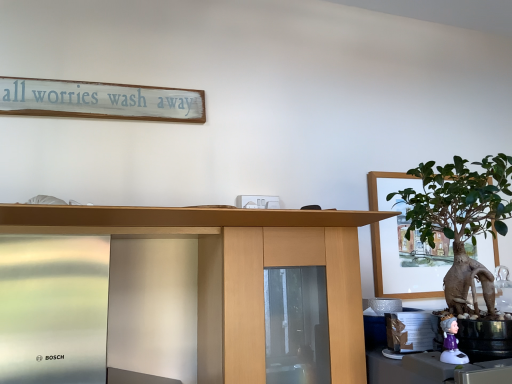
Question: Can you confirm if white painted wood signboard at upper center is taller than white plastic figurine at lower right?

Choices:
 (A) yes
 (B) no

Answer: (A)

Question: Is white painted wood signboard at upper center not close to white plastic figurine at lower right?

Choices:
 (A) yes
 (B) no

Answer: (A)

Question: Is white painted wood signboard at upper center at the left side of white plastic figurine at lower right?

Choices:
 (A) no
 (B) yes

Answer: (B)

Question: Is white painted wood signboard at upper center closer to the viewer compared to white plastic figurine at lower right?

Choices:
 (A) yes
 (B) no

Answer: (B)

Question: Is white painted wood signboard at upper center positioned behind white plastic figurine at lower right?

Choices:
 (A) no
 (B) yes

Answer: (B)

Question: Does point (269, 261) appear closer or farther from the camera than point (452, 322)?

Choices:
 (A) farther
 (B) closer

Answer: (A)

Question: Is wooden desk at center to the left or to the right of white plastic figurine at lower right in the image?

Choices:
 (A) right
 (B) left

Answer: (B)

Question: Based on their sizes in the image, would you say wooden desk at center is bigger or smaller than white plastic figurine at lower right?

Choices:
 (A) small
 (B) big

Answer: (B)

Question: Looking at their shapes, would you say wooden desk at center is wider or thinner than white plastic figurine at lower right?

Choices:
 (A) thin
 (B) wide

Answer: (B)

Question: Visually, is green matte houseplant at right positioned to the left or to the right of wooden desk at center?

Choices:
 (A) right
 (B) left

Answer: (A)

Question: Is green matte houseplant at right inside the boundaries of wooden desk at center, or outside?

Choices:
 (A) outside
 (B) inside

Answer: (A)

Question: Is green matte houseplant at right in front of or behind wooden desk at center in the image?

Choices:
 (A) behind
 (B) front

Answer: (A)

Question: Is point (500, 340) positioned closer to the camera than point (350, 337)?

Choices:
 (A) farther
 (B) closer

Answer: (B)

Question: From the image's perspective, is white painted wood signboard at upper center above or below wooden desk at center?

Choices:
 (A) below
 (B) above

Answer: (B)

Question: Is point click(112, 92) positioned closer to the camera than point click(51, 216)?

Choices:
 (A) farther
 (B) closer

Answer: (A)